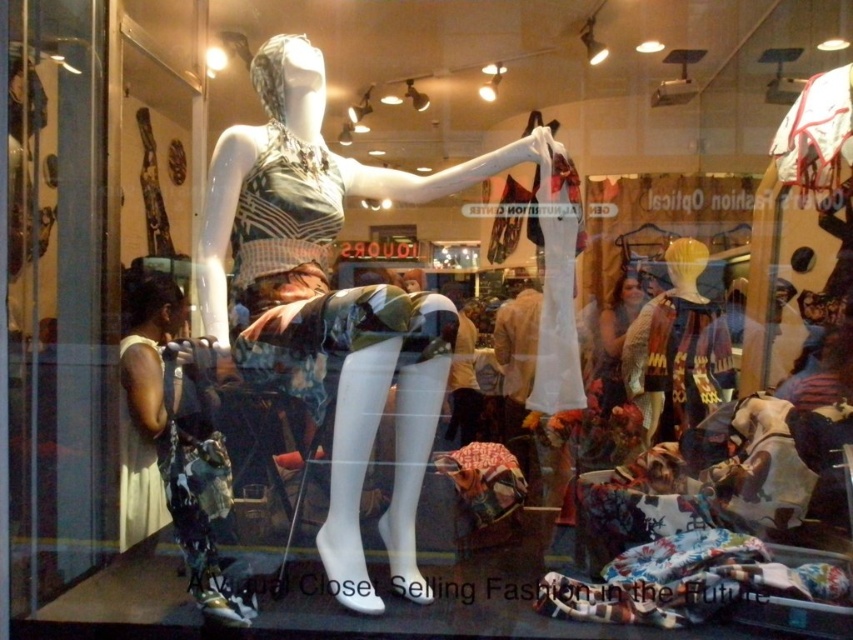
You are a customer trying to decide between two items in the store window. You see the printed fabric dress at left and the light beige fabric skirt at lower left. Which item takes up more space in the display?

The light beige fabric skirt at lower left takes up more space than the printed fabric dress at left.

You are a customer in the store and want to find the light beige fabric skirt at lower left. The store has a checkout counter at the back. Can you see the checkout counter from the point marked at coordinates point [137,484]?

The point [137,484] is on the light beige fabric skirt at lower left, so you are at the skirt location. Since the checkout counter is at the back of the store, you can see it from there.